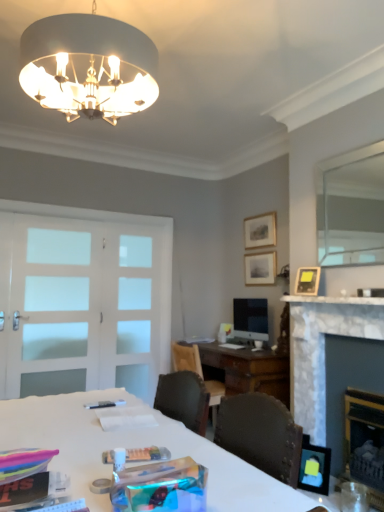
Question: Should I look upward or downward to see white frosted glass door at left, the second screen door when ordered from right to left?

Choices:
 (A) up
 (B) down

Answer: (B)

Question: Considering the relative sizes of white glossy desk at center and clear glass mirror at upper right in the image provided, is white glossy desk at center shorter than clear glass mirror at upper right?

Choices:
 (A) no
 (B) yes

Answer: (B)

Question: Does white glossy desk at center touch clear glass mirror at upper right?

Choices:
 (A) no
 (B) yes

Answer: (A)

Question: From the image's perspective, would you say white glossy desk at center is positioned over clear glass mirror at upper right?

Choices:
 (A) no
 (B) yes

Answer: (A)

Question: Is white glossy desk at center closer to the viewer compared to clear glass mirror at upper right?

Choices:
 (A) no
 (B) yes

Answer: (B)

Question: Does white glossy desk at center have a smaller size compared to clear glass mirror at upper right?

Choices:
 (A) yes
 (B) no

Answer: (B)

Question: From a real-world perspective, does white glossy desk at center stand above clear glass mirror at upper right?

Choices:
 (A) yes
 (B) no

Answer: (B)

Question: From a real-world perspective, is matte black picture frame at lower right, which is the 4th picture frame from top to bottom, physically below matte black picture frame at upper right, placed as the 2th picture frame when sorted from front to back?

Choices:
 (A) no
 (B) yes

Answer: (B)

Question: From a real-world perspective, is matte black picture frame at lower right, which is the 4th picture frame from top to bottom, physically above matte black picture frame at upper right, which is the second picture frame from bottom to top?

Choices:
 (A) yes
 (B) no

Answer: (B)

Question: From the image's perspective, would you say matte black picture frame at lower right, which is the 4th picture frame from top to bottom, is positioned over matte black picture frame at upper right, which is the second picture frame from bottom to top?

Choices:
 (A) yes
 (B) no

Answer: (B)

Question: Is matte black picture frame at lower right, which is counted as the 1th picture frame, starting from the front, bigger than matte black picture frame at upper right, which is the second picture frame from bottom to top?

Choices:
 (A) yes
 (B) no

Answer: (A)

Question: Does matte black picture frame at lower right, which is counted as the 4th picture frame, starting from the back, have a smaller size compared to matte black picture frame at upper right, which appears as the third picture frame when viewed from the back?

Choices:
 (A) no
 (B) yes

Answer: (A)

Question: Is the depth of matte black picture frame at lower right, which is counted as the 1th picture frame, starting from the front, less than that of matte black picture frame at upper right, placed as the 2th picture frame when sorted from front to back?

Choices:
 (A) yes
 (B) no

Answer: (A)

Question: Is the position of satin black monitor at center more distant than that of white frosted glass screen door at center, which is the 2th screen door in left-to-right order?

Choices:
 (A) no
 (B) yes

Answer: (A)